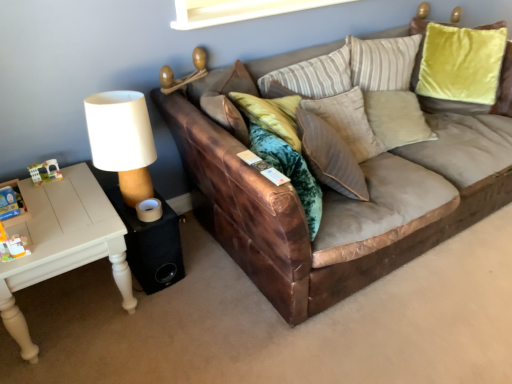
Question: Is suede-like beige pillow at center smaller than black fabric speaker at lower left?

Choices:
 (A) yes
 (B) no

Answer: (B)

Question: From a real-world perspective, is suede-like beige pillow at center below black fabric speaker at lower left?

Choices:
 (A) no
 (B) yes

Answer: (A)

Question: Is black fabric speaker at lower left inside suede-like beige pillow at center?

Choices:
 (A) no
 (B) yes

Answer: (A)

Question: Is suede-like beige pillow at center far from black fabric speaker at lower left?

Choices:
 (A) no
 (B) yes

Answer: (A)

Question: Is suede-like beige pillow at center bigger than black fabric speaker at lower left?

Choices:
 (A) yes
 (B) no

Answer: (A)

Question: Does suede-like beige pillow at center lie in front of black fabric speaker at lower left?

Choices:
 (A) no
 (B) yes

Answer: (B)

Question: Can you confirm if black fabric speaker at lower left is positioned to the right of white painted wood table at left?

Choices:
 (A) yes
 (B) no

Answer: (A)

Question: Could white painted wood table at left be considered to be inside black fabric speaker at lower left?

Choices:
 (A) no
 (B) yes

Answer: (A)

Question: From a real-world perspective, is black fabric speaker at lower left physically above white painted wood table at left?

Choices:
 (A) no
 (B) yes

Answer: (A)

Question: Is black fabric speaker at lower left oriented away from white painted wood table at left?

Choices:
 (A) yes
 (B) no

Answer: (B)

Question: Does black fabric speaker at lower left come behind white painted wood table at left?

Choices:
 (A) yes
 (B) no

Answer: (A)

Question: From the image's perspective, is black fabric speaker at lower left beneath white painted wood table at left?

Choices:
 (A) no
 (B) yes

Answer: (A)

Question: Considering the relative positions of brown leather couch at center and white painted wood table at left in the image provided, is brown leather couch at center to the right of white painted wood table at left from the viewer's perspective?

Choices:
 (A) no
 (B) yes

Answer: (B)